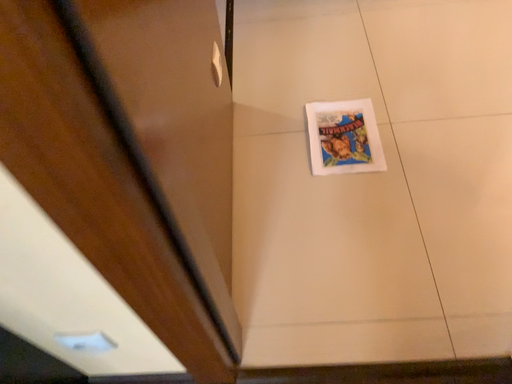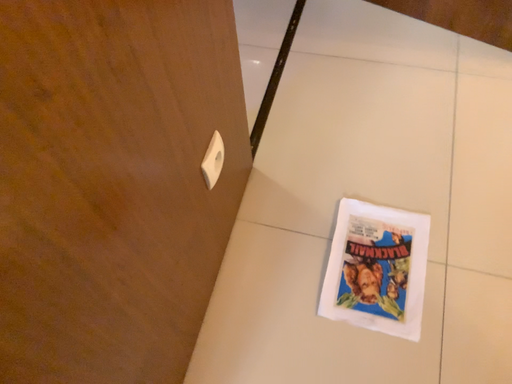
Question: Which way did the camera rotate in the video?

Choices:
 (A) rotated right
 (B) rotated left

Answer: (B)